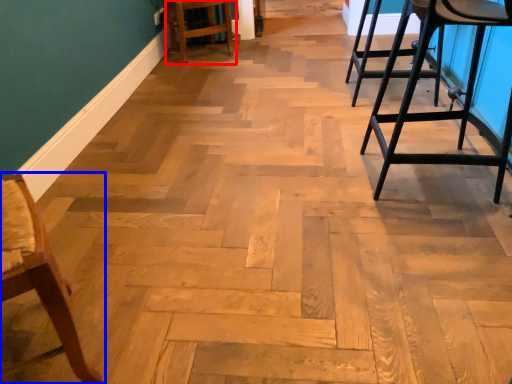
Question: Which object is further to the camera taking this photo, bar stool (highlighted by a red box) or chair (highlighted by a blue box)?

Choices:
 (A) bar stool
 (B) chair

Answer: (A)